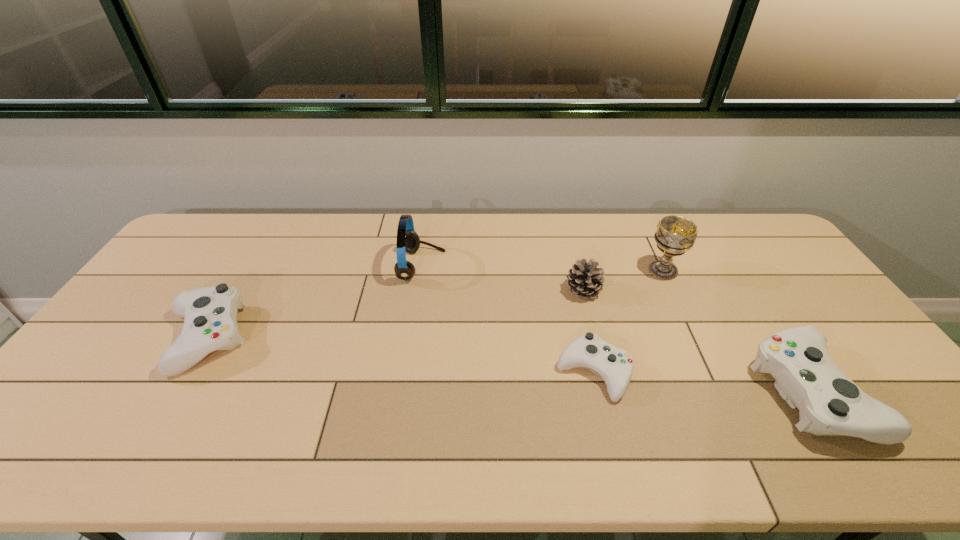
In order to click on the leftmost object in this screenshot , I will do `click(210, 323)`.

Where is `the second shortest control`? This screenshot has width=960, height=540. the second shortest control is located at coordinates (210, 323).

Locate an element on the screen. the shortest control is located at coordinates (615, 365).

The image size is (960, 540). I want to click on the second control from left to right, so click(x=615, y=365).

Find the location of `the rightmost object`. the rightmost object is located at coordinates (830, 404).

Find the location of a particular element. This screenshot has height=540, width=960. headset is located at coordinates (408, 240).

Where is `chalice`? This screenshot has height=540, width=960. chalice is located at coordinates click(x=675, y=235).

At what (x,y) coordinates should I click in order to perform the action: click on pinecone. Please return your answer as a coordinate pair (x, y). The image size is (960, 540). Looking at the image, I should click on (585, 279).

Find the location of a particular element. free region located 0.070m on the left of the leftmost control is located at coordinates (135, 339).

You are a GUI agent. You are given a task and a screenshot of the screen. Output one action in this format:
    pyautogui.click(x=<x>, y=<y>)
    Task: Click on the vacant space located on the back of the shortest control
    The width and height of the screenshot is (960, 540).
    Given the screenshot: What is the action you would take?
    pyautogui.click(x=571, y=273)